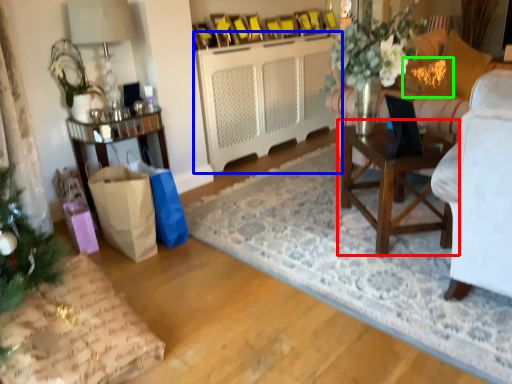
Question: Which object is positioned closest to table (highlighted by a red box)? Select from cabinetry (highlighted by a blue box) and pillow (highlighted by a green box).

Choices:
 (A) cabinetry
 (B) pillow

Answer: (B)